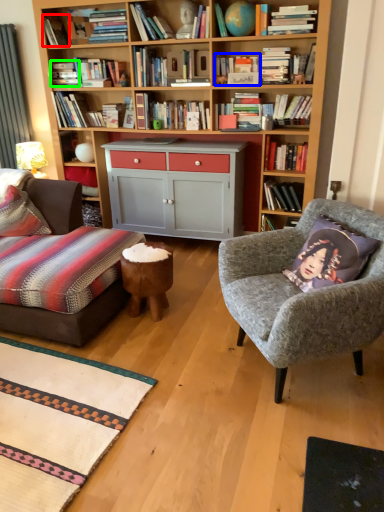
Question: Based on their relative distances, which object is nearer to book (highlighted by a red box)? Choose from book (highlighted by a blue box) and book (highlighted by a green box).

Choices:
 (A) book
 (B) book

Answer: (B)